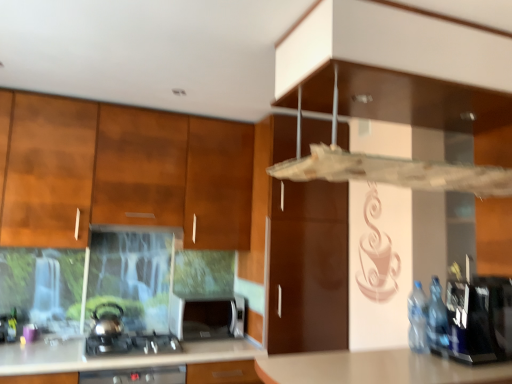
Consider the image. In order to face satin silver toaster at lower center, should I rotate leftwards or rightwards?

Turn left approximately 6.055 degrees to face it.

Measure the distance between wooden cabinet at left and camera.

wooden cabinet at left is 2.55 meters from camera.

Image resolution: width=512 pixels, height=384 pixels. I want to click on white glossy countertop at lower left, so click(x=115, y=356).

Image resolution: width=512 pixels, height=384 pixels. What do you see at coordinates (131, 345) in the screenshot? I see `satin black gas stove at lower left` at bounding box center [131, 345].

What do you see at coordinates (406, 123) in the screenshot?
I see `transparent plastic vent at upper center` at bounding box center [406, 123].

Locate an element on the screen. This screenshot has width=512, height=384. satin silver toaster at lower center is located at coordinates (207, 317).

Is satin black gas stove at lower left taller or shorter than satin silver toaster at lower center?

satin black gas stove at lower left is shorter than satin silver toaster at lower center.

Which point is more distant from viewer, (162, 337) or (211, 320)?

Point (211, 320)

Based on the photo, from the image's perspective, relative to satin silver toaster at lower center, is satin black gas stove at lower left above or below?

Based on their image positions, satin black gas stove at lower left is located beneath satin silver toaster at lower center.

In terms of size, does satin black gas stove at lower left appear bigger or smaller than satin silver toaster at lower center?

Considering their sizes, satin black gas stove at lower left takes up less space than satin silver toaster at lower center.

What's the angular difference between blue plastic bottles at right and transparent plastic vent at upper center's facing directions?

They differ by 88.2 degrees in their facing directions.

Considering the sizes of objects blue plastic bottles at right and transparent plastic vent at upper center in the image provided, who is thinner, blue plastic bottles at right or transparent plastic vent at upper center?

With smaller width is blue plastic bottles at right.

Is the surface of blue plastic bottles at right in direct contact with transparent plastic vent at upper center?

No, blue plastic bottles at right is not in contact with transparent plastic vent at upper center.

Is the depth of blue plastic bottles at right less than that of transparent plastic vent at upper center?

That is False.

Is wooden cabinet at left at the back of satin silver toaster at lower center?

No, wooden cabinet at left is not at the back of satin silver toaster at lower center.

Find the location of a particular element. cabinetry located above the satin silver toaster at lower center (from the image's perspective) is located at coordinates (120, 172).

Considering the relative sizes of satin silver toaster at lower center and wooden cabinet at left in the image provided, is satin silver toaster at lower center wider than wooden cabinet at left?

No.

From a real-world perspective, who is located lower, white glossy countertop at lower left or satin silver toaster at lower center?

white glossy countertop at lower left, from a real-world perspective.

Is white glossy countertop at lower left turned away from satin silver toaster at lower center?

No, white glossy countertop at lower left is not facing away from satin silver toaster at lower center.

Measure the distance between white glossy countertop at lower left and satin silver toaster at lower center.

A distance of 16.16 inches exists between white glossy countertop at lower left and satin silver toaster at lower center.

Could satin silver toaster at lower center be considered to be inside white glossy countertop at lower left?

That's incorrect, satin silver toaster at lower center is not inside white glossy countertop at lower left.

Is blue plastic bottles at right bigger than satin black gas stove at lower left?

Yes, blue plastic bottles at right is bigger than satin black gas stove at lower left.

From the image's perspective, relative to satin black gas stove at lower left, is blue plastic bottles at right above or below?

blue plastic bottles at right is above satin black gas stove at lower left.

Find the location of a particular element. appliance above the satin black gas stove at lower left (from the image's perspective) is located at coordinates (479, 320).

Is blue plastic bottles at right outside of satin black gas stove at lower left?

Yes.

How different are the orientations of blue plastic bottles at right and satin silver kettle at lower left in degrees?

The angle between the facing direction of blue plastic bottles at right and the facing direction of satin silver kettle at lower left is 88.9 degrees.

Are blue plastic bottles at right and satin silver kettle at lower left located far from each other?

That's right, there is a large distance between blue plastic bottles at right and satin silver kettle at lower left.

Where is `appliance above the satin silver kettle at lower left (from a real-world perspective)`? The image size is (512, 384). appliance above the satin silver kettle at lower left (from a real-world perspective) is located at coordinates (479, 320).

From a real-world perspective, is blue plastic bottles at right under satin silver kettle at lower left?

Incorrect, from a real-world perspective, blue plastic bottles at right is higher than satin silver kettle at lower left.

This screenshot has height=384, width=512. I want to click on kitchen appliance to the left of blue plastic bottles at right, so click(106, 322).

From the picture: Is satin silver kettle at lower left behind blue plastic bottles at right?

Yes, it is.

Is blue plastic bottles at right located within satin silver kettle at lower left?

Actually, blue plastic bottles at right is outside satin silver kettle at lower left.

Is blue plastic bottles at right at the back of satin silver kettle at lower left?

That's not correct — satin silver kettle at lower left is not looking away from blue plastic bottles at right.

This screenshot has height=384, width=512. What are the coordinates of `home appliance above the satin black gas stove at lower left (from the image's perspective)` in the screenshot? It's located at (207, 317).

This screenshot has width=512, height=384. I want to click on appliance below the transparent plastic vent at upper center (from the image's perspective), so click(479, 320).

When comparing their distances from satin silver kettle at lower left, does satin black gas stove at lower left or satin silver toaster at lower center seem further?

satin silver toaster at lower center.

Considering their positions, is blue plastic bottles at right positioned further to satin silver kettle at lower left than satin black gas stove at lower left?

blue plastic bottles at right lies further to satin silver kettle at lower left than the other object.

Which object lies further to the anchor point white glossy countertop at lower left, transparent plastic vent at upper center or satin silver kettle at lower left?

transparent plastic vent at upper center is further to white glossy countertop at lower left.

Which object lies further to the anchor point transparent plastic vent at upper center, blue plastic bottles at right or wooden cabinet at left?

Based on the image, wooden cabinet at left appears to be further to transparent plastic vent at upper center.

When comparing their distances from satin silver toaster at lower center, does blue plastic bottles at right or transparent plastic vent at upper center seem closer?

blue plastic bottles at right is closer to satin silver toaster at lower center.

Estimate the real-world distances between objects in this image. Which object is closer to white glossy countertop at lower left, satin silver toaster at lower center or blue plastic bottles at right?

Based on the image, satin silver toaster at lower center appears to be nearer to white glossy countertop at lower left.

Looking at the image, which one is located further to satin silver kettle at lower left, wooden cabinet at left or satin silver toaster at lower center?

Among the two, wooden cabinet at left is located further to satin silver kettle at lower left.

Based on their spatial positions, is blue plastic bottles at right or transparent plastic vent at upper center closer to white glossy countertop at lower left?

blue plastic bottles at right.

Locate an element on the screen. This screenshot has width=512, height=384. cabinetry between satin silver kettle at lower left and transparent plastic vent at upper center is located at coordinates (120, 172).

Where is `kitchen appliance between white glossy countertop at lower left and satin silver toaster at lower center in the front-back direction`? kitchen appliance between white glossy countertop at lower left and satin silver toaster at lower center in the front-back direction is located at coordinates 106,322.

Identify the location of gas stove between satin silver kettle at lower left and transparent plastic vent at upper center. (131, 345).

Locate an element on the screen. The width and height of the screenshot is (512, 384). home appliance between wooden cabinet at left and satin black gas stove at lower left from top to bottom is located at coordinates (207, 317).